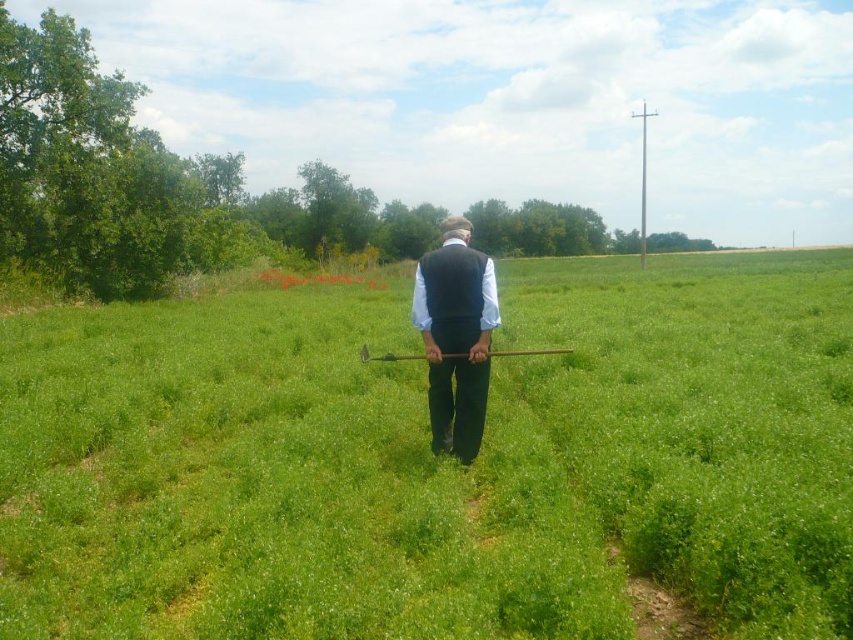
Question: Among these objects, which one is farthest from the camera?

Choices:
 (A) green grassy field at center
 (B) black matte vest at center

Answer: (B)

Question: Is green grassy field at center below black matte vest at center?

Choices:
 (A) yes
 (B) no

Answer: (B)

Question: Is green grassy field at center wider than black matte vest at center?

Choices:
 (A) yes
 (B) no

Answer: (A)

Question: Is green grassy field at center bigger than black matte vest at center?

Choices:
 (A) no
 (B) yes

Answer: (B)